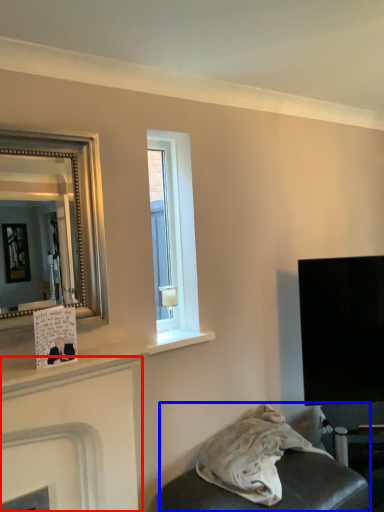
Question: Which object appears farthest to the camera in this image, fireplace (highlighted by a red box) or furniture (highlighted by a blue box)?

Choices:
 (A) fireplace
 (B) furniture

Answer: (B)